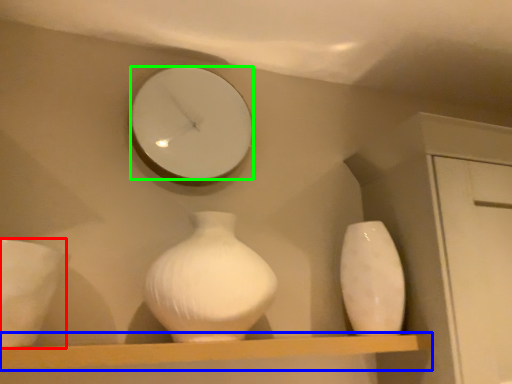
Question: Which object is the farthest from porcelain (highlighted by a red box)? Choose among these: shelf (highlighted by a blue box) or mirror (highlighted by a green box).

Choices:
 (A) shelf
 (B) mirror

Answer: (B)